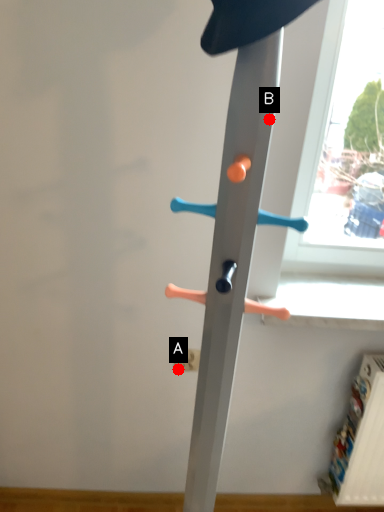
Question: Two points are circled on the image, labeled by A and B beside each circle. Which point is closer to the camera taking this photo?

Choices:
 (A) A is closer
 (B) B is closer

Answer: (B)